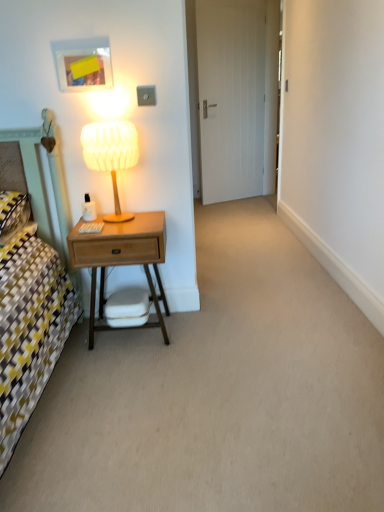
This screenshot has height=512, width=384. Identify the location of free space in front of wooden nightstand at left. (130, 372).